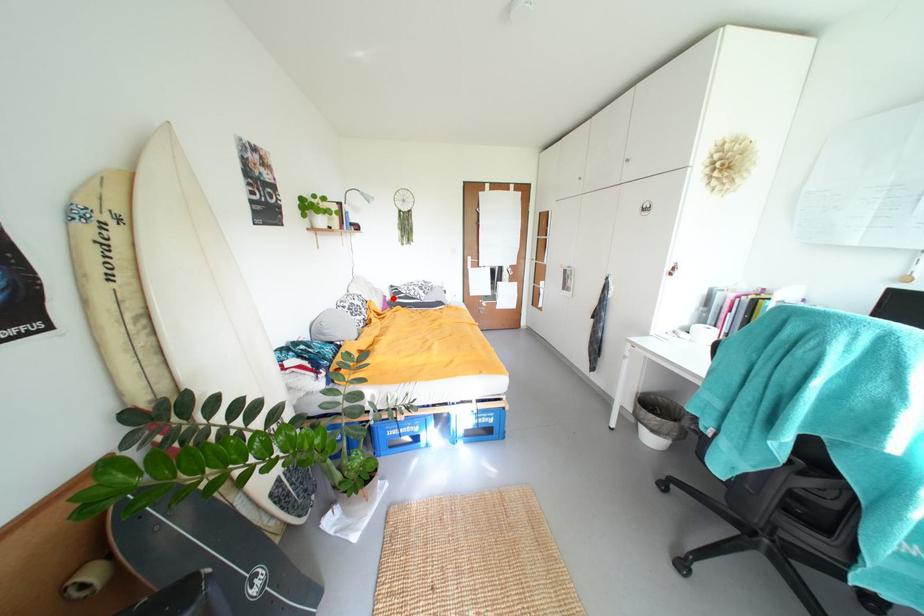
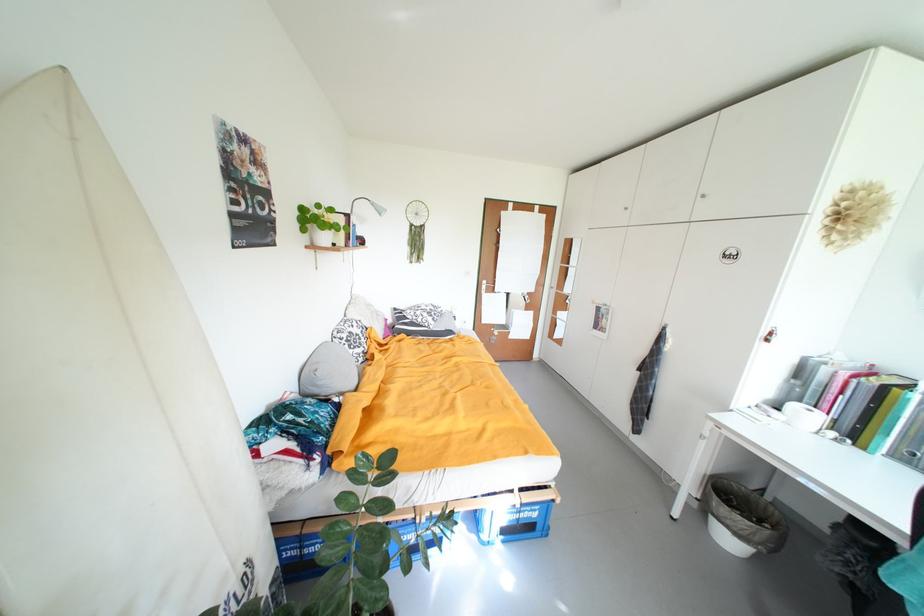
Locate, in the second image, the point that corresponds to the highlighted location in the first image.

(394, 322)